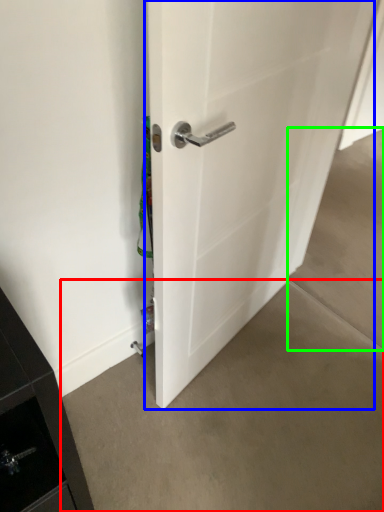
Question: Estimate the real-world distances between objects in this image. Which object is closer to concrete (highlighted by a red box), door (highlighted by a blue box) or concrete (highlighted by a green box)?

Choices:
 (A) door
 (B) concrete

Answer: (A)